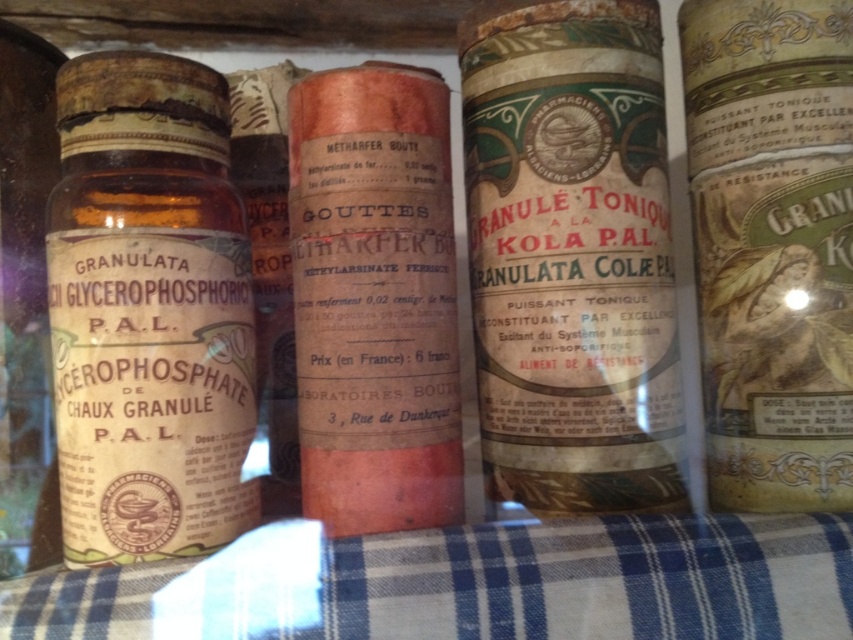
Looking at this image, which of these two, vintage paper-toned tonique at center or orange paper bottle at center, stands shorter?

Standing shorter between the two is orange paper bottle at center.

Is vintage paper-toned tonique at center to the right of orange paper bottle at center from the viewer's perspective?

Correct, you'll find vintage paper-toned tonique at center to the right of orange paper bottle at center.

Does point (839, 273) come closer to viewer compared to point (440, 502)?

No, (839, 273) is behind (440, 502).

The height and width of the screenshot is (640, 853). Find the location of `vintage paper-toned tonique at center`. vintage paper-toned tonique at center is located at coordinates (772, 244).

Is green paper label at center shorter than amber glass bottle at left?

No.

I want to click on green paper label at center, so click(572, 253).

Measure the distance between amber glass bottle at left and vintage paper-toned tonique at center.

amber glass bottle at left is 16.34 inches from vintage paper-toned tonique at center.

What do you see at coordinates (148, 310) in the screenshot? I see `amber glass bottle at left` at bounding box center [148, 310].

The image size is (853, 640). Identify the location of amber glass bottle at left. (148, 310).